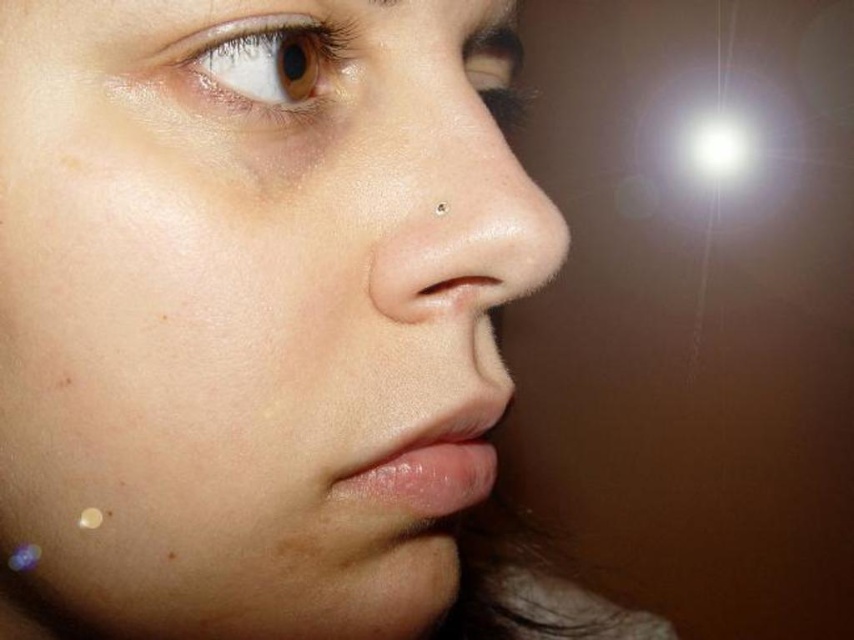
Question: Based on their relative distances, which object is nearer to the smooth skin face at center?

Choices:
 (A) brown matte eye at upper left
 (B) brown matte freckle at lower center

Answer: (A)

Question: Among these objects, which one is nearest to the camera?

Choices:
 (A) brown matte eye at upper left
 (B) brown matte freckle at lower center
 (C) smooth skin nose at center

Answer: (A)

Question: Does smooth skin nose at center appear on the left side of brown matte eye at upper left?

Choices:
 (A) yes
 (B) no

Answer: (B)

Question: Can you confirm if brown matte eye at upper left is bigger than brown matte freckle at lower center?

Choices:
 (A) yes
 (B) no

Answer: (A)

Question: Is brown matte eye at upper left above brown matte freckle at lower center?

Choices:
 (A) no
 (B) yes

Answer: (B)

Question: Considering the real-world distances, which object is farthest from the smooth skin nose at center?

Choices:
 (A) smooth skin face at center
 (B) brown matte freckle at lower center
 (C) brown matte eye at upper left

Answer: (B)